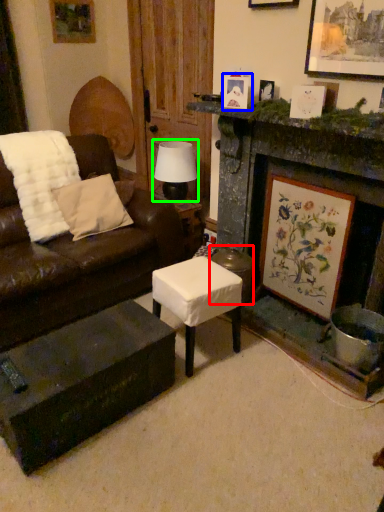
Question: Which object is positioned farthest from stool (highlighted by a red box)? Select from picture frame (highlighted by a blue box) and table lamp (highlighted by a green box).

Choices:
 (A) picture frame
 (B) table lamp

Answer: (A)